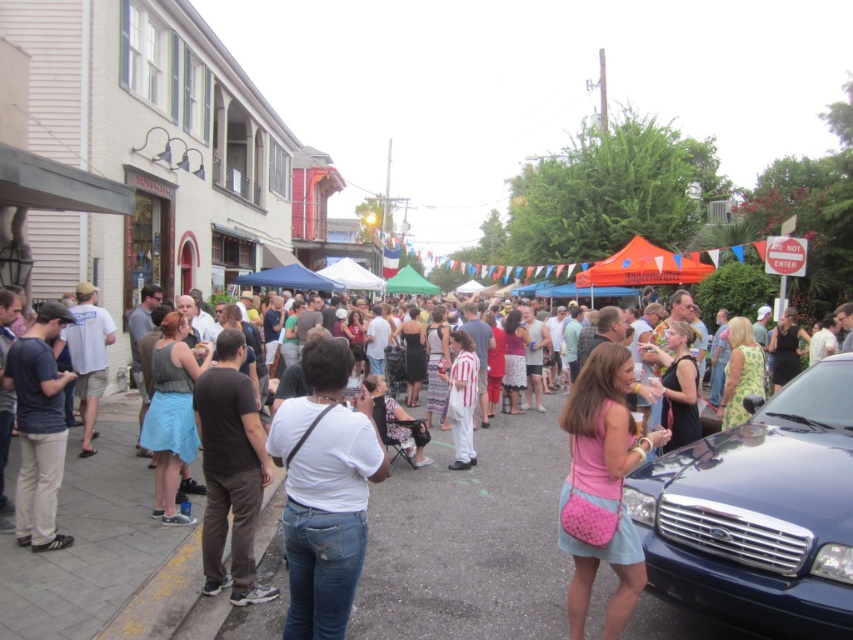
Can you confirm if pink fabric purse at center is positioned below dark brown cotton pants at left?

Yes.

Which is behind, point (608, 605) or point (198, 403)?

Positioned behind is point (198, 403).

Locate an element on the screen. The image size is (853, 640). pink fabric purse at center is located at coordinates (602, 483).

Who is positioned more to the left, smooth asphalt pavement at center or white matte shirt at center?

Positioned to the left is white matte shirt at center.

Image resolution: width=853 pixels, height=640 pixels. I want to click on smooth asphalt pavement at center, so click(469, 541).

Is point (277, 602) positioned after point (350, 532)?

Yes, point (277, 602) is farther from viewer.

Where is `smooth asphalt pavement at center`? The height and width of the screenshot is (640, 853). smooth asphalt pavement at center is located at coordinates tap(469, 541).

Is dark blue shirt at left below white striped dress at center?

Incorrect, dark blue shirt at left is not positioned below white striped dress at center.

Who is positioned more to the right, dark blue shirt at left or white striped dress at center?

From the viewer's perspective, white striped dress at center appears more on the right side.

Who is more distant from viewer, (36, 419) or (456, 332)?

The point (456, 332) is more distant.

This screenshot has width=853, height=640. In order to click on dark blue shirt at left in this screenshot , I will do `click(39, 428)`.